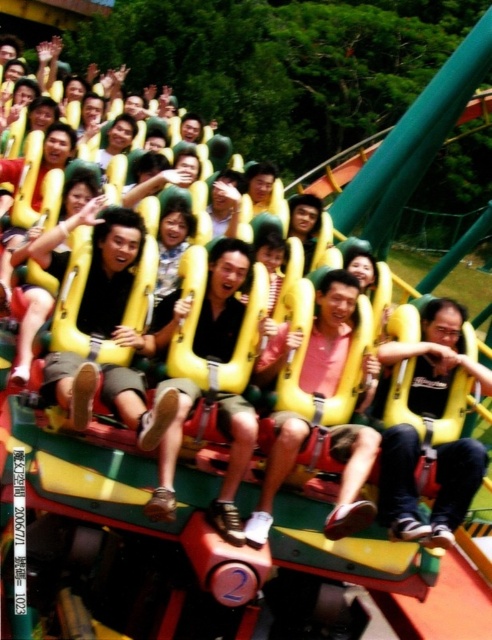
Consider the image. You are a photographer trying to capture a candid shot of the riders on the roller coaster. You need to ensure that both the dark blue jeans at center and the matte black shirt at center are clearly visible in the photo. Given their positions and sizes, which clothing item would appear wider in the photograph?

The dark blue jeans at center would appear wider in the photograph because its width surpasses that of the matte black shirt at center.

You are standing in front of the roller coaster and want to take a photo. There are two points on the track you want to capture clearly. Which point, point (409, 448) or point (242, 259), is closer to your camera?

Point (409, 448) is closer to the camera than point (242, 259), so it will appear clearer in the photo.